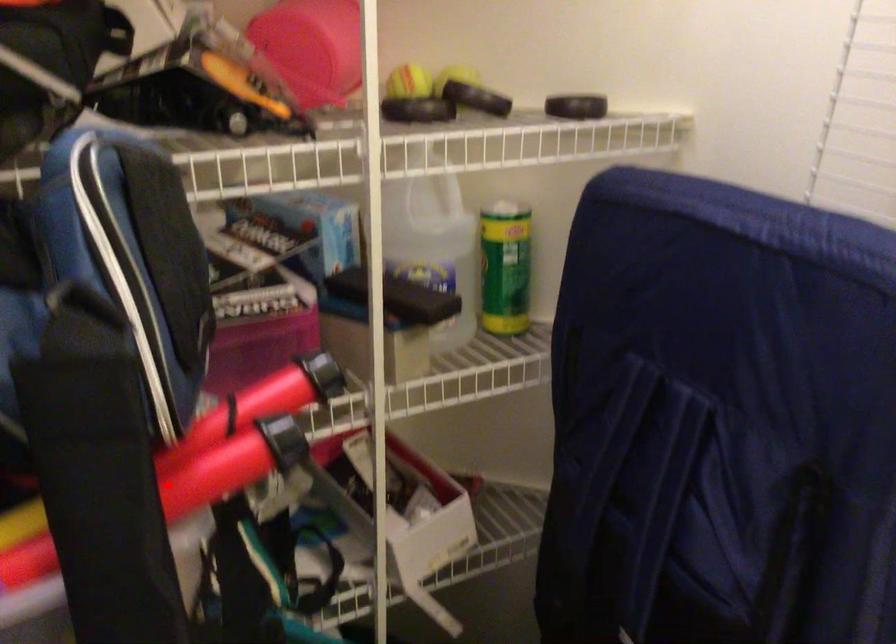
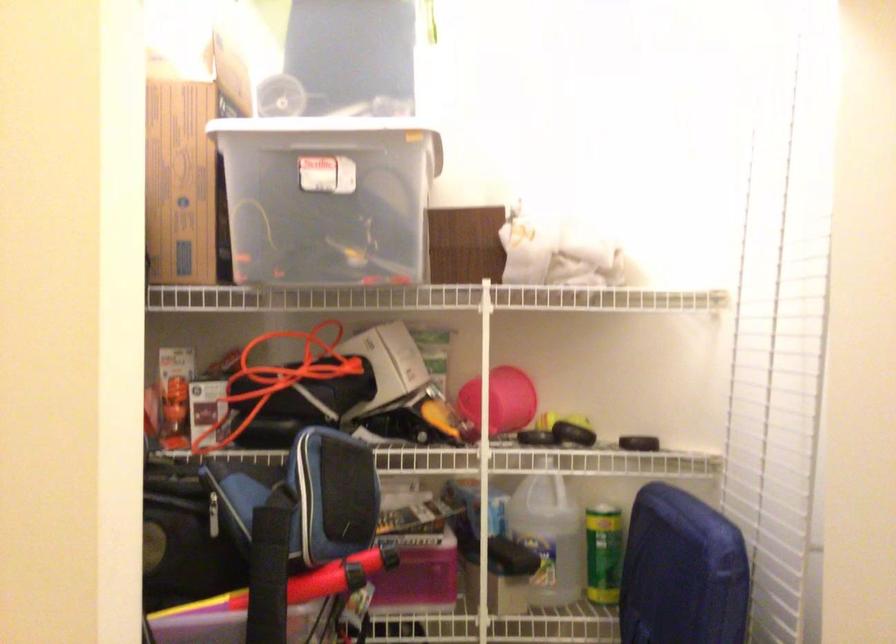
The point at the highlighted location is marked in the first image. Where is the corresponding point in the second image?

(298, 583)